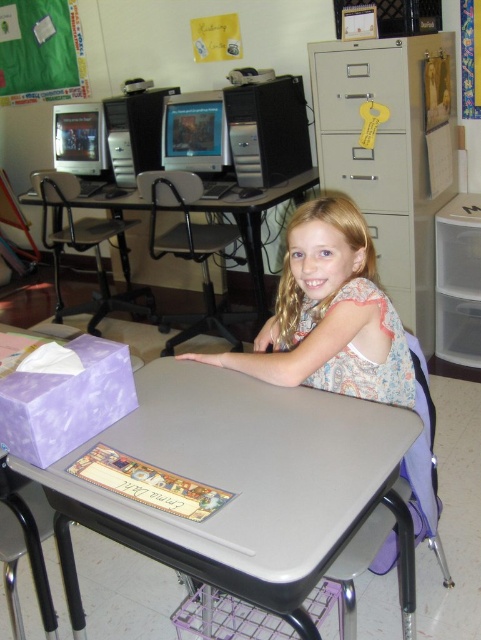
Is beige/file cabinet at upper center positioned at the back of floral dress at center?

Yes, it is behind floral dress at center.

Which of these two, beige/file cabinet at upper center or floral dress at center, stands taller?

Standing taller between the two is beige/file cabinet at upper center.

Does point (417, 202) come farther from viewer compared to point (301, 362)?

That is True.

You are a GUI agent. You are given a task and a screenshot of the screen. Output one action in this format:
    pyautogui.click(x=<x>, y=<y>)
    Task: Click on the beige/file cabinet at upper center
    The height and width of the screenshot is (640, 481).
    Given the screenshot: What is the action you would take?
    pyautogui.click(x=391, y=152)

Between point (283, 492) and point (231, 196), which one is positioned in front?

Point (283, 492) is in front.

Is matte gray table at center shorter than gray plastic table at center?

A: Yes.

Between point (192, 422) and point (287, 193), which one is positioned in front?

Point (192, 422) is in front.

The image size is (481, 640). In order to click on matte gray table at center in this screenshot , I will do `click(242, 477)`.

Which is more to the right, matte gray table at center or floral dress at center?

Positioned to the right is floral dress at center.

Can you confirm if matte gray table at center is positioned to the right of floral dress at center?

Incorrect, matte gray table at center is not on the right side of floral dress at center.

Is point (264, 442) farther from camera compared to point (283, 348)?

No, it is in front of (283, 348).

Identify the location of matte gray table at center. The width and height of the screenshot is (481, 640). (242, 477).